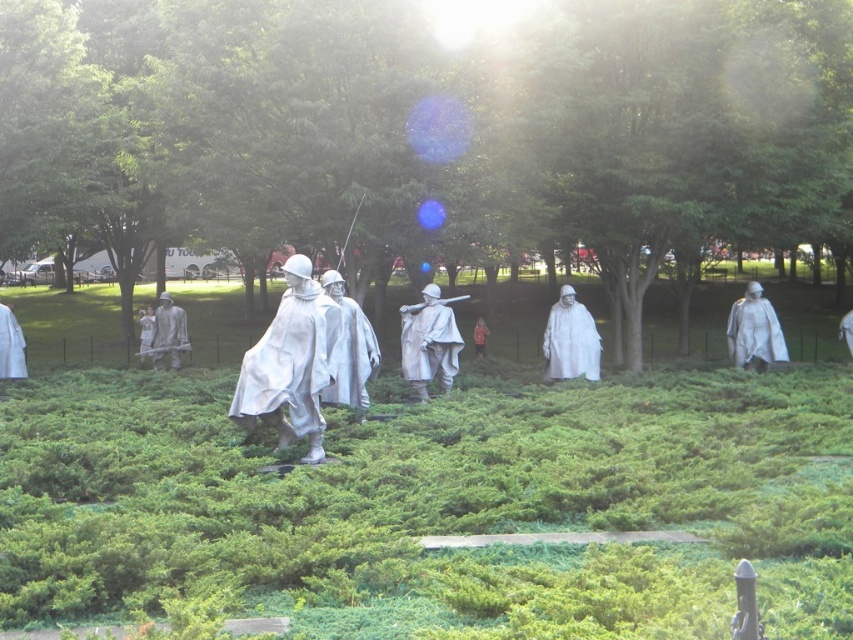
Between polished silver statue at center and white matte statue at left, which one is positioned lower?

polished silver statue at center is below.

Where is `polished silver statue at center`? polished silver statue at center is located at coordinates (350, 352).

Is point (341, 385) farther from viewer compared to point (0, 358)?

No, (341, 385) is closer to viewer.

Identify the location of polished silver statue at center. (350, 352).

Who is more forward, (427, 323) or (12, 324)?

Positioned in front is point (427, 323).

Who is positioned more to the left, polished bronze statue at center or white matte statue at left?

white matte statue at left

Between point (431, 321) and point (21, 352), which one is positioned behind?

The point (21, 352) is behind.

Where is `polished bronze statue at center`? polished bronze statue at center is located at coordinates (428, 340).

Does white glossy statue at center appear on the right side of polished bronze statue at right?

Incorrect, white glossy statue at center is not on the right side of polished bronze statue at right.

Is point (299, 433) positioned in front of point (763, 298)?

Yes, it is.

Which is behind, point (321, 358) or point (769, 346)?

Positioned behind is point (769, 346).

At what (x,y) coordinates should I click in order to perform the action: click on white glossy statue at center. Please return your answer as a coordinate pair (x, y). The height and width of the screenshot is (640, 853). Looking at the image, I should click on (291, 364).